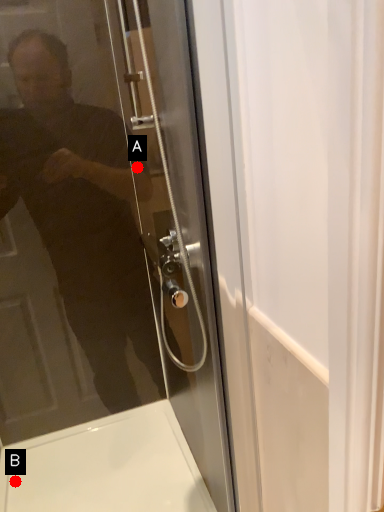
Question: Two points are circled on the image, labeled by A and B beside each circle. Which point is farther from the camera taking this photo?

Choices:
 (A) A is further
 (B) B is further

Answer: (B)